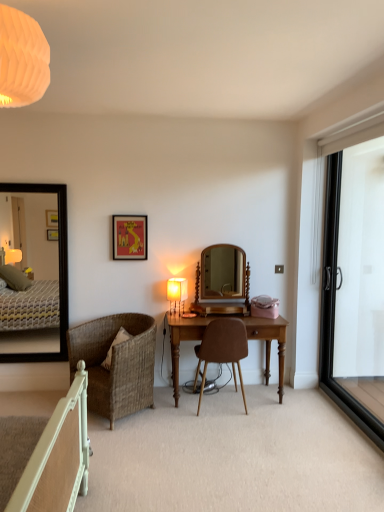
What is the approximate height of brown leather chair at center, marked as the first chair in a right-to-left arrangement?

33.31 inches.

Image resolution: width=384 pixels, height=512 pixels. Find the location of `black glass screen door at right`. black glass screen door at right is located at coordinates (354, 284).

You are a GUI agent. You are given a task and a screenshot of the screen. Output one action in this format:
    pyautogui.click(x=<x>, y=<y>)
    Task: Click on the matte yellow lampshade at center, positioned as the second lamp in top-to-bottom order
    Image resolution: width=384 pixels, height=512 pixels.
    Given the screenshot: What is the action you would take?
    pyautogui.click(x=177, y=293)

Based on their sizes in the image, would you say brown leather chair at center, marked as the first chair in a right-to-left arrangement, is bigger or smaller than wooden desk at center?

Clearly, brown leather chair at center, marked as the first chair in a right-to-left arrangement, is smaller in size than wooden desk at center.

Is brown leather chair at center, which appears as the second chair when viewed from the left, outside of wooden desk at center?

No, most part of brown leather chair at center, which appears as the second chair when viewed from the left, lies within wooden desk at center.

Does brown leather chair at center, marked as the first chair in a right-to-left arrangement, appear on the right side of wooden desk at center?

Incorrect, brown leather chair at center, marked as the first chair in a right-to-left arrangement, is not on the right side of wooden desk at center.

Is brown leather chair at center, which appears as the second chair when viewed from the left, turned away from wooden desk at center?

Correct, brown leather chair at center, which appears as the second chair when viewed from the left, is looking away from wooden desk at center.

Does woven rattan chair at lower left, the second chair from the right, have a greater height compared to matte yellow lampshade at center, which appears as the 2th lamp when viewed from the left?

Yes, woven rattan chair at lower left, the second chair from the right, is taller than matte yellow lampshade at center, which appears as the 2th lamp when viewed from the left.

Which is more to the right, woven rattan chair at lower left, the second chair from the right, or matte yellow lampshade at center, which appears as the 2th lamp when viewed from the left?

From the viewer's perspective, matte yellow lampshade at center, which appears as the 2th lamp when viewed from the left, appears more on the right side.

In terms of width, does woven rattan chair at lower left, the second chair from the right, look wider or thinner when compared to matte yellow lampshade at center, positioned as the second lamp in top-to-bottom order?

In the image, woven rattan chair at lower left, the second chair from the right, appears to be wider than matte yellow lampshade at center, positioned as the second lamp in top-to-bottom order.

From a real-world perspective, who is located higher, woven rattan chair at lower left, the first chair viewed from the left, or matte yellow lampshade at center, the 1th lamp positioned from the back?

matte yellow lampshade at center, the 1th lamp positioned from the back, is physically above.

Considering the relative positions of black glass screen door at right and matte white power outlet at center-right in the image provided, is black glass screen door at right in front of matte white power outlet at center-right?

Yes, black glass screen door at right is in front of matte white power outlet at center-right.

Considering the positions of objects black glass screen door at right and matte white power outlet at center-right in the image provided, who is more to the left, black glass screen door at right or matte white power outlet at center-right?

From the viewer's perspective, matte white power outlet at center-right appears more on the left side.

Is black glass screen door at right positioned with its back to matte white power outlet at center-right?

No, black glass screen door at right's orientation is not away from matte white power outlet at center-right.

Is matte white power outlet at center-right inside black glass screen door at right?

No, matte white power outlet at center-right is not a part of black glass screen door at right.

Is matte yellow lampshade at center, positioned as the second lamp in top-to-bottom order, taller or shorter than woven rattan chair at lower left, the first chair viewed from the left?

In the image, matte yellow lampshade at center, positioned as the second lamp in top-to-bottom order, appears to be shorter than woven rattan chair at lower left, the first chair viewed from the left.

From the image's perspective, starting from the woven rattan chair at lower left, the second chair from the right, which lamp is the 1st one above? Please provide its 2D coordinates.

[(177, 293)]

Which is more to the right, matte yellow lampshade at center, positioned as the second lamp in top-to-bottom order, or woven rattan chair at lower left, the first chair viewed from the left?

Positioned to the right is matte yellow lampshade at center, positioned as the second lamp in top-to-bottom order.

How much distance is there between matte yellow lampshade at center, which is counted as the 2th lamp, starting from the front, and woven rattan chair at lower left, the second chair from the right?

The distance of matte yellow lampshade at center, which is counted as the 2th lamp, starting from the front, from woven rattan chair at lower left, the second chair from the right, is 27.94 inches.

Considering the relative sizes of matte yellow lampshade at center, the 1th lamp positioned from the back, and wooden mirror at center, which appears as the 2th mirror when viewed from the left, in the image provided, is matte yellow lampshade at center, the 1th lamp positioned from the back, smaller than wooden mirror at center, which appears as the 2th mirror when viewed from the left,?

Yes.

From the image's perspective, relative to wooden mirror at center, which appears as the 2th mirror when viewed from the left, is matte yellow lampshade at center, the 1th lamp positioned from the back, above or below?

From the image's perspective, matte yellow lampshade at center, the 1th lamp positioned from the back, appears below wooden mirror at center, which appears as the 2th mirror when viewed from the left.

From a real-world perspective, is matte yellow lampshade at center, the 1th lamp positioned from the back, physically located above or below wooden mirror at center, which appears as the 2th mirror when viewed from the left?

matte yellow lampshade at center, the 1th lamp positioned from the back, is situated lower than wooden mirror at center, which appears as the 2th mirror when viewed from the left, in the real world.

Which of these two, matte yellow lampshade at center, placed as the first lamp when sorted from bottom to top, or wooden mirror at center, which appears as the 2th mirror when viewed from the left, is thinner?

With smaller width is matte yellow lampshade at center, placed as the first lamp when sorted from bottom to top.

From the image's perspective, does matte white power outlet at center-right appear lower than matte red picture frame at upper center?

Yes, from the image's perspective, matte white power outlet at center-right is beneath matte red picture frame at upper center.

Between matte white power outlet at center-right and matte red picture frame at upper center, which one has larger size?

matte red picture frame at upper center is bigger.

From a real-world perspective, which is physically below, matte white power outlet at center-right or matte red picture frame at upper center?

From a 3D spatial view, matte white power outlet at center-right is below.

Which of these two, matte orange lampshade at upper left, positioned as the first lamp in left-to-right order, or woven rattan chair at lower left, the first chair viewed from the left, is smaller?

With smaller size is matte orange lampshade at upper left, positioned as the first lamp in left-to-right order.

Is matte orange lampshade at upper left, positioned as the first lamp in left-to-right order, at the left side of woven rattan chair at lower left, the second chair from the right?

No, matte orange lampshade at upper left, positioned as the first lamp in left-to-right order, is not to the left of woven rattan chair at lower left, the second chair from the right.

Is matte orange lampshade at upper left, the second lamp positioned from the back, turned away from woven rattan chair at lower left, the second chair from the right?

matte orange lampshade at upper left, the second lamp positioned from the back, does not have its back to woven rattan chair at lower left, the second chair from the right.

Locate an element on the screen. desk located underneath the brown leather chair at center, which appears as the second chair when viewed from the left (from a real-world perspective) is located at coordinates (269, 342).

At what (x,y) coordinates should I click in order to perform the action: click on the 2nd lamp to the right of the woven rattan chair at lower left, the first chair viewed from the left, starting your count from the anchor. Please return your answer as a coordinate pair (x, y). The height and width of the screenshot is (512, 384). Looking at the image, I should click on 177,293.

Considering their positions, is woven brown pillow at lower left positioned closer to matte yellow lampshade at center, placed as the first lamp when sorted from bottom to top, than brown leather chair at center, which appears as the second chair when viewed from the left?

brown leather chair at center, which appears as the second chair when viewed from the left, lies closer to matte yellow lampshade at center, placed as the first lamp when sorted from bottom to top, than the other object.

From the image, which object appears to be nearer to black glass screen door at right, black framed mirror at left, the 2th mirror from the right, or wooden mirror at center, which appears as the 2th mirror when viewed from the left?

wooden mirror at center, which appears as the 2th mirror when viewed from the left, is positioned closer to the anchor black glass screen door at right.

When comparing their distances from matte white power outlet at center-right, does woven brown pillow at lower left or wooden mirror at center, which is counted as the 1th mirror, starting from the right, seem closer?

wooden mirror at center, which is counted as the 1th mirror, starting from the right, is closer to matte white power outlet at center-right.

In the scene shown: Considering their positions, is brown leather chair at center, marked as the first chair in a right-to-left arrangement, positioned further to matte yellow lampshade at center, which is counted as the 2th lamp, starting from the front, than matte red picture frame at upper center?

brown leather chair at center, marked as the first chair in a right-to-left arrangement, lies further to matte yellow lampshade at center, which is counted as the 2th lamp, starting from the front, than the other object.

When comparing their distances from matte orange lampshade at upper left, the 2th lamp when ordered from right to left, does woven rattan chair at lower left, the first chair viewed from the left, or matte red picture frame at upper center seem further?

matte red picture frame at upper center lies further to matte orange lampshade at upper left, the 2th lamp when ordered from right to left, than the other object.

From the image, which object appears to be farther from matte orange lampshade at upper left, positioned as the first lamp in left-to-right order, matte white power outlet at center-right or black framed mirror at left, the first mirror positioned from the left?

matte white power outlet at center-right is positioned further to the anchor matte orange lampshade at upper left, positioned as the first lamp in left-to-right order.

Based on their spatial positions, is matte yellow lampshade at center, positioned as the second lamp in top-to-bottom order, or woven brown pillow at lower left closer to matte white power outlet at center-right?

matte yellow lampshade at center, positioned as the second lamp in top-to-bottom order, is positioned closer to the anchor matte white power outlet at center-right.

Estimate the real-world distances between objects in this image. Which object is closer to wooden desk at center, woven brown pillow at lower left or wooden mirror at center, which appears as the 2th mirror when viewed from the left?

The object closer to wooden desk at center is wooden mirror at center, which appears as the 2th mirror when viewed from the left.

Locate an element on the screen. pillow located between matte orange lampshade at upper left, which is the 1th lamp from top to bottom, and matte yellow lampshade at center, positioned as the second lamp in top-to-bottom order, in the depth direction is located at coordinates (114, 345).

Locate an element on the screen. The image size is (384, 512). pillow located between woven rattan chair at lower left, the first chair viewed from the left, and black glass screen door at right in the left-right direction is located at coordinates [114, 345].

At what (x,y) coordinates should I click in order to perform the action: click on pillow located between black framed mirror at left, the 2th mirror from the right, and black glass screen door at right in the left-right direction. Please return your answer as a coordinate pair (x, y). This screenshot has height=512, width=384. Looking at the image, I should click on (114, 345).

This screenshot has width=384, height=512. I want to click on power outlet between black framed mirror at left, the first mirror positioned from the left, and black glass screen door at right, in the horizontal direction, so click(x=279, y=269).